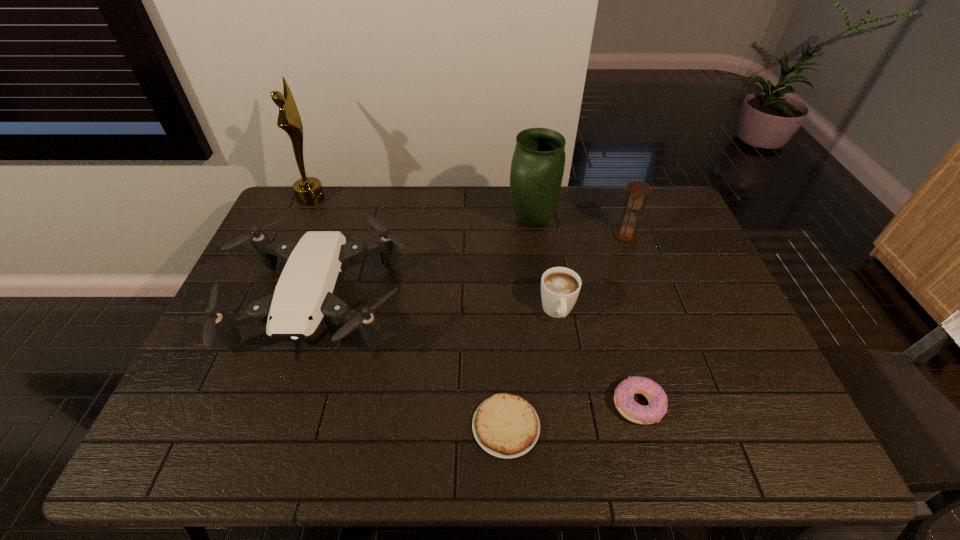
At what (x,y) coordinates should I click in order to perform the action: click on free spot located 0.090m on the left of the second tallest object. Please return your answer as a coordinate pair (x, y). This screenshot has height=540, width=960. Looking at the image, I should click on (480, 221).

The width and height of the screenshot is (960, 540). Identify the location of vacant space located 0.100m on the right of the hourglass. (667, 235).

The width and height of the screenshot is (960, 540). In order to click on free space located 0.140m on the camera side of the fourth tallest object in this screenshot , I will do tap(277, 438).

You are a GUI agent. You are given a task and a screenshot of the screen. Output one action in this format:
    pyautogui.click(x=<x>, y=<y>)
    Task: Click on the free space located 0.330m with the handle on the side of the third shortest object
    The width and height of the screenshot is (960, 540).
    Given the screenshot: What is the action you would take?
    pyautogui.click(x=580, y=455)

The height and width of the screenshot is (540, 960). Identify the location of vacant area located 0.350m on the left of the sixth object from left to right. (463, 404).

I want to click on vacant space positioned on the left of the tortilla, so point(317,426).

I want to click on award at the far edge, so click(x=308, y=190).

The width and height of the screenshot is (960, 540). What are the coordinates of `vase at the far edge` in the screenshot? It's located at (538, 162).

Identify the location of hourglass that is at the far edge. The image size is (960, 540). (637, 189).

Locate an element on the screen. This screenshot has width=960, height=540. doughnut located in the near edge section of the desktop is located at coordinates (624, 401).